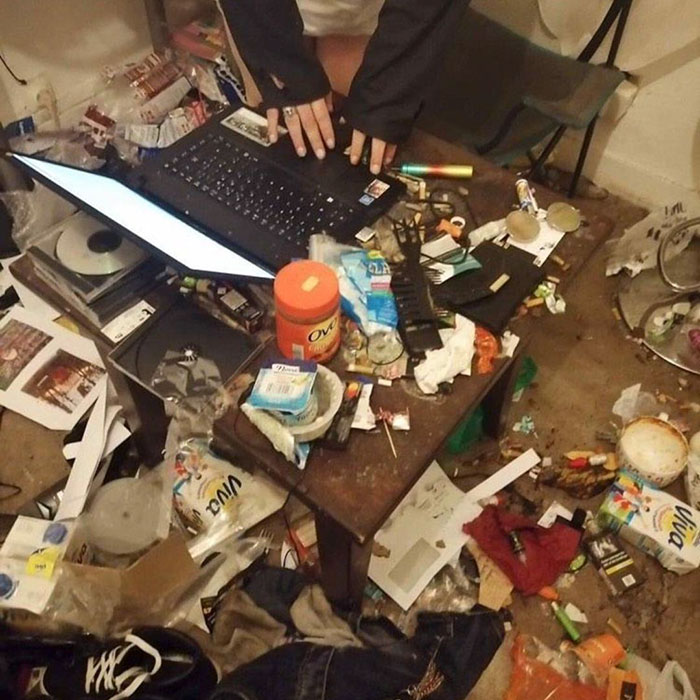
Find the location of a particular element. floor is located at coordinates (577, 374).